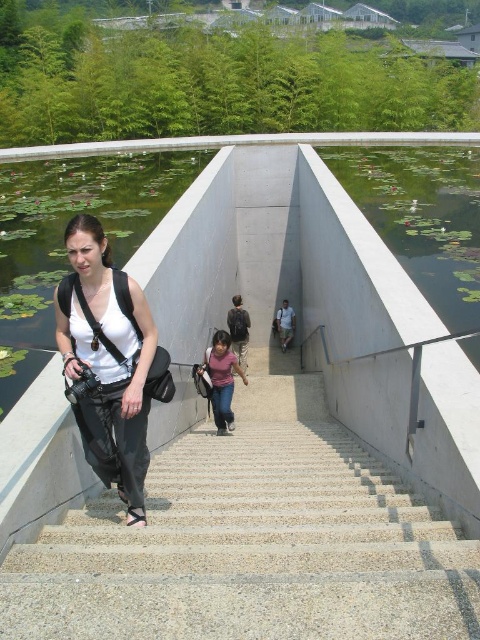
In the scene shown: Which of these two, green lily pads at left or green smooth water at upper right, stands shorter?

With less height is green smooth water at upper right.

Does green lily pads at left appear on the left side of green smooth water at upper right?

Yes, green lily pads at left is to the left of green smooth water at upper right.

This screenshot has height=640, width=480. Describe the element at coordinates (61, 237) in the screenshot. I see `green lily pads at left` at that location.

Where is `green lily pads at left`? The width and height of the screenshot is (480, 640). green lily pads at left is located at coordinates (61, 237).

Is white matte tank top at center to the right of pink fabric shirt at center from the viewer's perspective?

Incorrect, white matte tank top at center is not on the right side of pink fabric shirt at center.

Is white matte tank top at center above pink fabric shirt at center?

Yes.

Locate an element on the screen. white matte tank top at center is located at coordinates (108, 360).

Does green lily pads at left have a lesser height compared to white matte tank top at center?

No, green lily pads at left is not shorter than white matte tank top at center.

Find the location of a particular element. green lily pads at left is located at coordinates (61, 237).